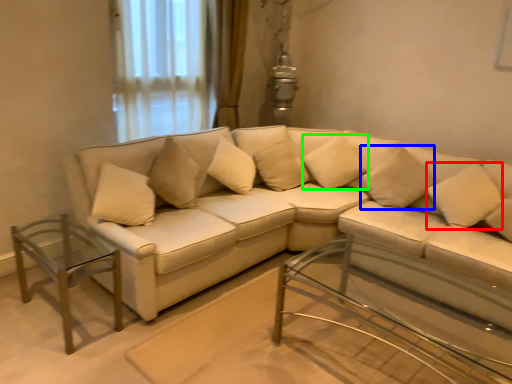
Question: Based on their relative distances, which object is farther from pillow (highlighted by a red box)? Choose from pillow (highlighted by a blue box) and pillow (highlighted by a green box).

Choices:
 (A) pillow
 (B) pillow

Answer: (B)